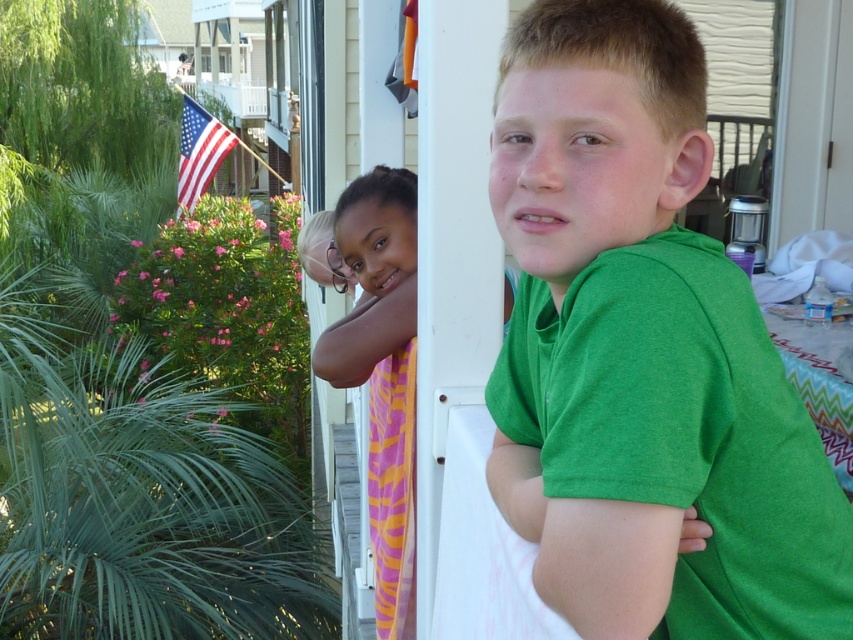
Does green cotton shirt at center have a lesser width compared to matte green shirt at center?

Correct, green cotton shirt at center's width is less than matte green shirt at center's.

Locate an element on the screen. This screenshot has width=853, height=640. green cotton shirt at center is located at coordinates (643, 353).

Is matte green shirt at center thinner than american flag at upper left?

Yes, matte green shirt at center is thinner than american flag at upper left.

Does matte green shirt at center have a smaller size compared to american flag at upper left?

Indeed, matte green shirt at center has a smaller size compared to american flag at upper left.

Who is more forward, (x=323, y=332) or (x=189, y=124)?

Positioned in front is point (x=323, y=332).

Where is `matte green shirt at center`? This screenshot has height=640, width=853. matte green shirt at center is located at coordinates (373, 275).

Can you confirm if green cotton shirt at center is smaller than american flag at upper left?

Yes, green cotton shirt at center is smaller than american flag at upper left.

Is green cotton shirt at center taller than american flag at upper left?

No.

Between point (846, 504) and point (181, 168), which one is positioned behind?

Point (181, 168)

In order to click on green cotton shirt at center in this screenshot , I will do `click(643, 353)`.